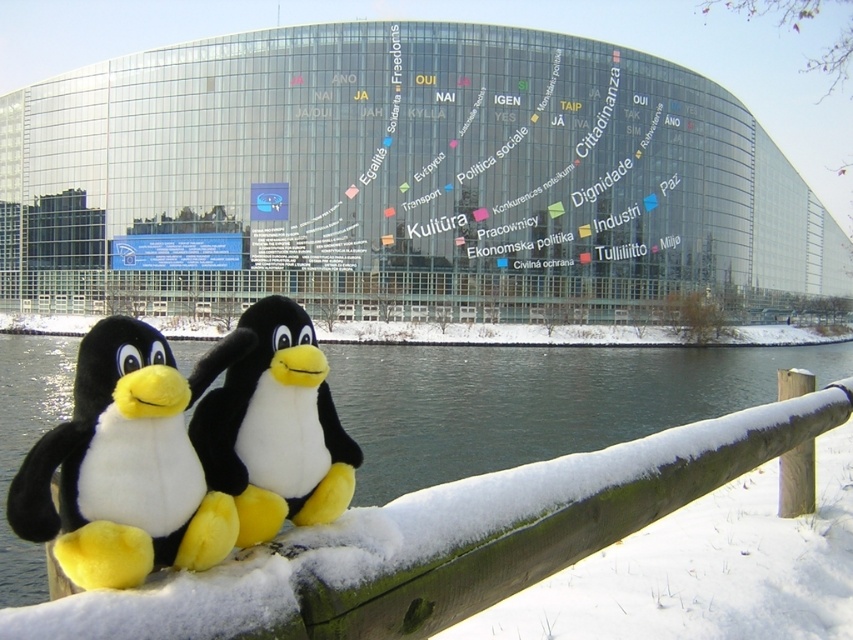
Between point (368, 438) and point (288, 497), which one is positioned behind?

Point (368, 438)

Is point (645, 365) positioned after point (253, 449)?

Yes, point (645, 365) is behind point (253, 449).

At what (x,y) coordinates should I click in order to perform the action: click on white snow-covered water at lower center. Please return your answer as a coordinate pair (x, y). Looking at the image, I should click on (534, 401).

Can you confirm if white snow-covered water at lower center is positioned above black plush penguin at lower left?

Incorrect, white snow-covered water at lower center is not positioned above black plush penguin at lower left.

Is point (703, 380) farther from viewer compared to point (194, 371)?

Yes, point (703, 380) is farther from viewer.

Image resolution: width=853 pixels, height=640 pixels. Identify the location of white snow-covered water at lower center. (534, 401).

Who is positioned more to the right, black plush penguin at lower left or black plush penguin at lower center?

From the viewer's perspective, black plush penguin at lower center appears more on the right side.

Where is `black plush penguin at lower left`? The height and width of the screenshot is (640, 853). black plush penguin at lower left is located at coordinates (126, 464).

What are the coordinates of `black plush penguin at lower left` in the screenshot? It's located at (126, 464).